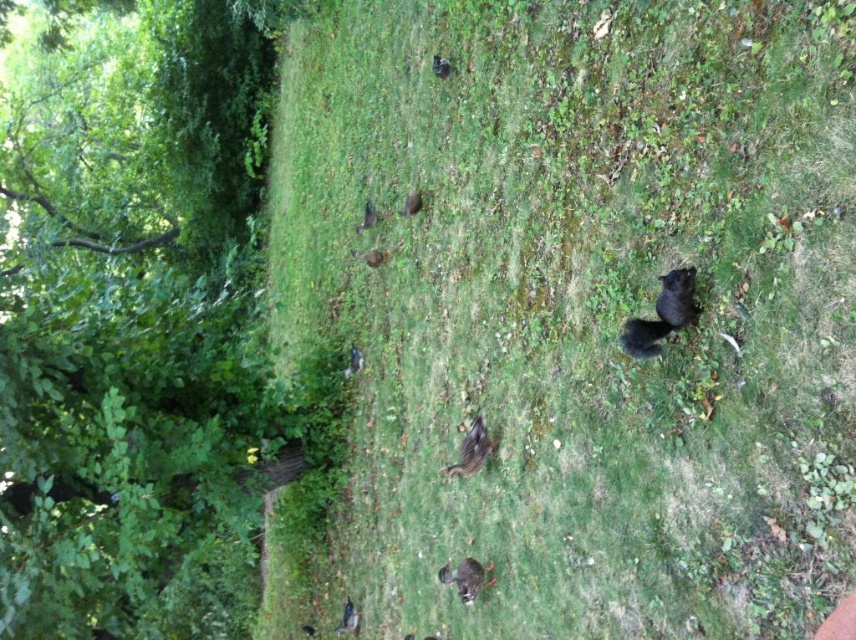
You are standing in a grassy area with scattered birds and want to take a photo of the point at coordinates point (840, 92). If your camera has a focal length of 50mm and you are 1.61 meters away from the point, what is the angle of view required to capture the entire scene around the point?

The point (840, 92) is 1.61 meters away from the viewer. To calculate the angle of view needed, use the formula angle of view equals two times the arctangent of half the sensor width divided by the focal length. However, without knowing the sensor size or the desired field of view, an exact angle cannot be determined. Ensure your camera settings accommodate the distance for proper framing.